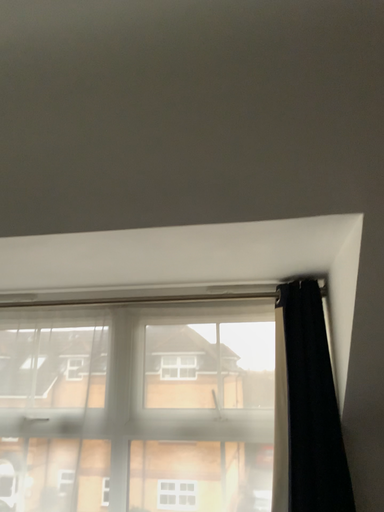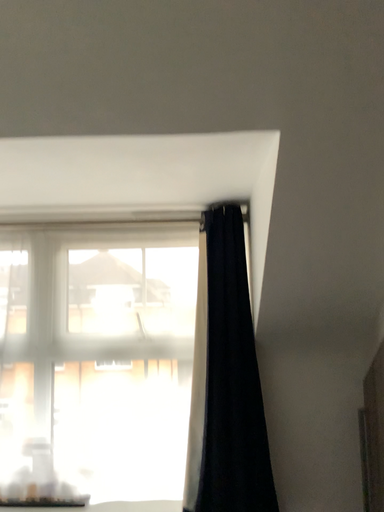
Question: How did the camera likely rotate when shooting the video?

Choices:
 (A) rotated left
 (B) rotated right

Answer: (B)